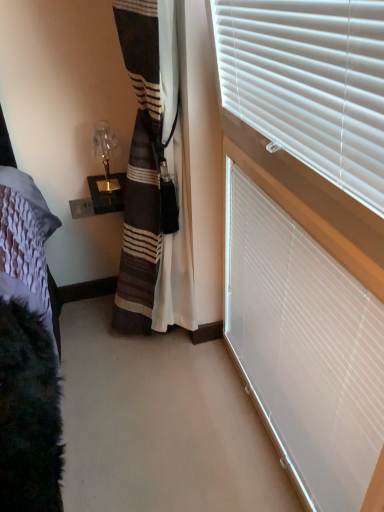
In order to face white plastic blinds at upper right, should I rotate leftwards or rightwards?

To face it directly, rotate right by 11.273 degrees.

The width and height of the screenshot is (384, 512). What do you see at coordinates (304, 346) in the screenshot?
I see `white plastic blinds at upper right` at bounding box center [304, 346].

This screenshot has height=512, width=384. In order to click on white plastic blinds at upper right in this screenshot , I will do `click(304, 346)`.

You are a GUI agent. You are given a task and a screenshot of the screen. Output one action in this format:
    pyautogui.click(x=<x>, y=<y>)
    Task: Click on the white plastic blinds at upper right
    
    Given the screenshot: What is the action you would take?
    pyautogui.click(x=304, y=346)